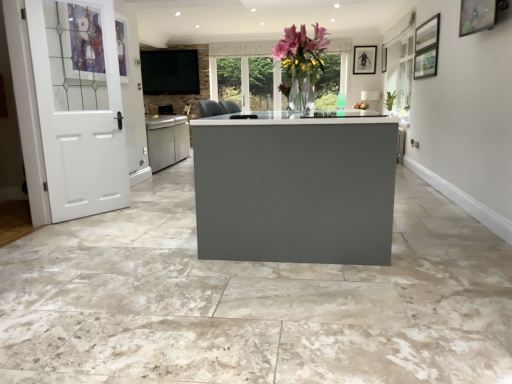
Question: In the image, is wooden picture frame at upper right, placed as the 2th picture frame when sorted from back to front, positioned in front of or behind matte black tv at upper center?

Choices:
 (A) front
 (B) behind

Answer: (A)

Question: Is point (478, 11) closer or farther from the camera than point (176, 81)?

Choices:
 (A) farther
 (B) closer

Answer: (B)

Question: Considering the real-world distances, which object is closest to the white painted wood door at left?

Choices:
 (A) matte black tv at upper center
 (B) wooden picture frame at upper right, acting as the 2th picture frame starting from the top
 (C) matte black picture frame at upper right, arranged as the first picture frame when viewed from the right

Answer: (A)

Question: Estimate the real-world distances between objects in this image. Which object is farther from the matte black tv at upper center?

Choices:
 (A) wooden picture frame at upper right, placed as the 2th picture frame when sorted from back to front
 (B) matte black picture frame at upper right, placed as the 1th picture frame when sorted from back to front
 (C) white painted wood door at left

Answer: (A)